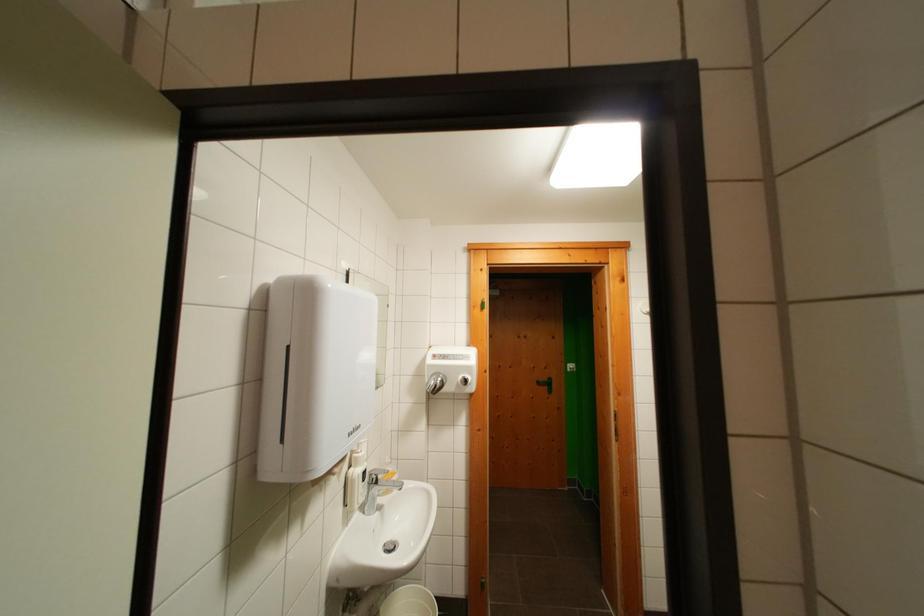
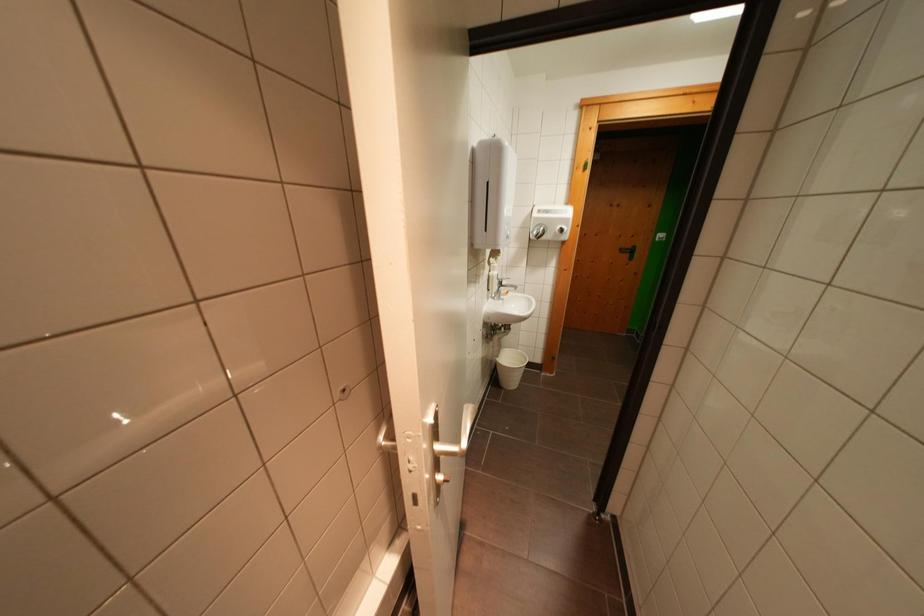
The images are taken continuously from a first-person perspective. In which direction is your viewpoint rotating?

The camera's rotation is toward left-down.